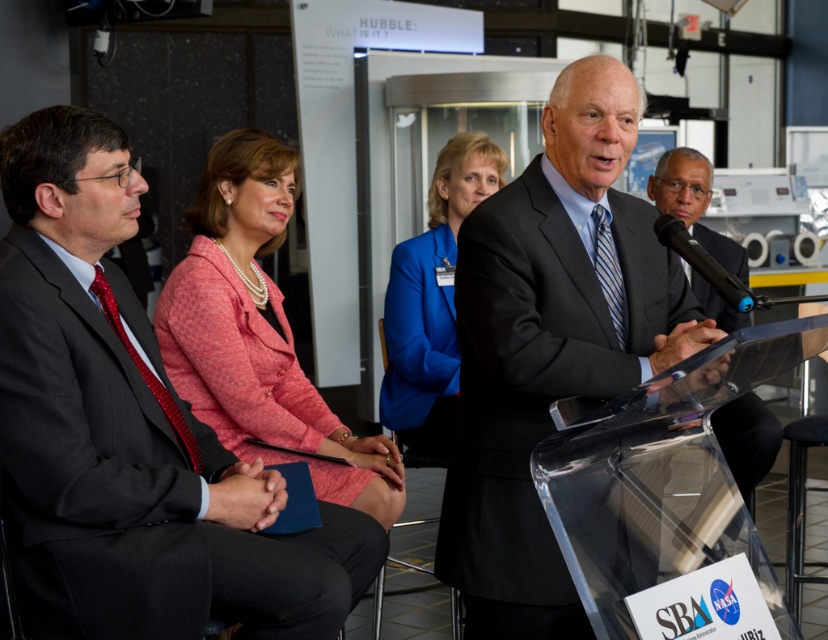
Can you confirm if matte black suit at center is thinner than black glossy suit at center?

No.

Which is in front, point (482, 525) or point (723, 308)?

Positioned in front is point (482, 525).

Identify the location of matte black suit at center. The image size is (828, 640). (549, 348).

Can you confirm if dark gray pinstripe suit at left is positioned above black plastic microphone at center?

No, dark gray pinstripe suit at left is not above black plastic microphone at center.

Can you confirm if dark gray pinstripe suit at left is thinner than black plastic microphone at center?

Incorrect, dark gray pinstripe suit at left's width is not less than black plastic microphone at center's.

What do you see at coordinates (133, 492) in the screenshot?
I see `dark gray pinstripe suit at left` at bounding box center [133, 492].

Identify the location of dark gray pinstripe suit at left. The width and height of the screenshot is (828, 640). (133, 492).

The height and width of the screenshot is (640, 828). What do you see at coordinates (258, 332) in the screenshot?
I see `pink textured blazer at center` at bounding box center [258, 332].

Is point (388, 497) positioned behind point (421, 276)?

No, (388, 497) is closer to viewer.

Between point (302, 429) and point (445, 424), which one is positioned in front?

Point (302, 429) is in front.

The width and height of the screenshot is (828, 640). Find the location of `pink textured blazer at center`. pink textured blazer at center is located at coordinates (258, 332).